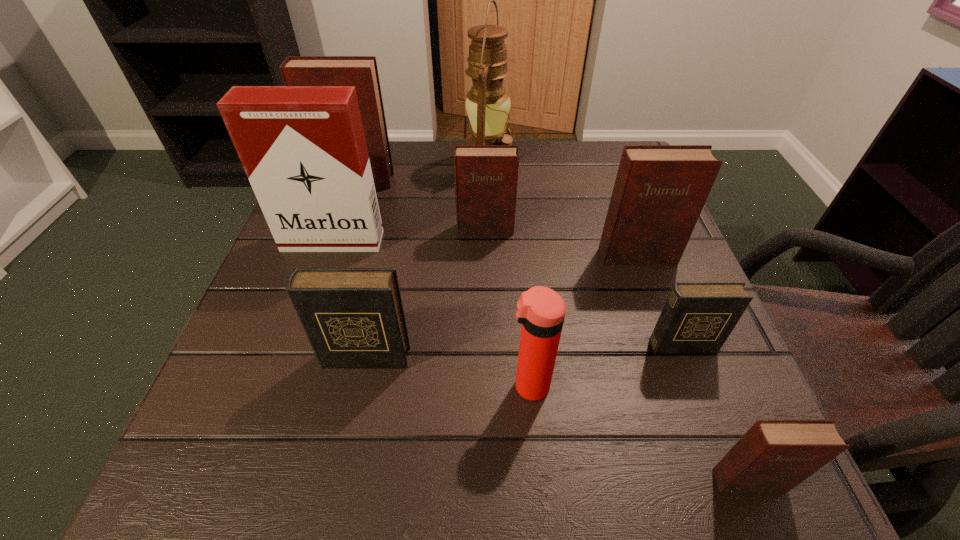
Find the location of `the right dark diary`. the right dark diary is located at coordinates (698, 317).

Image resolution: width=960 pixels, height=540 pixels. Identify the location of the nearest diary. (773, 455).

Locate an element on the screen. Image resolution: width=960 pixels, height=540 pixels. the nearest reddish-brown diary is located at coordinates (773, 455).

The height and width of the screenshot is (540, 960). I want to click on vacant area situated 0.400m on the front of the oil lamp, so click(x=492, y=310).

Where is `vacant space located on the front-facing side of the red cigarette_case`? vacant space located on the front-facing side of the red cigarette_case is located at coordinates (283, 383).

Identify the location of free space located 0.160m on the front cover of the farthest diary. (337, 234).

In order to click on vacant space located 0.360m on the front cover of the third farthest diary in this screenshot , I will do `click(708, 454)`.

Where is `vacant position located 0.060m on the back of the second nearest object`? The height and width of the screenshot is (540, 960). vacant position located 0.060m on the back of the second nearest object is located at coordinates (525, 340).

Where is `free spot located on the front cover of the third nearest reddish-brown diary`? free spot located on the front cover of the third nearest reddish-brown diary is located at coordinates (486, 258).

The height and width of the screenshot is (540, 960). In order to click on vacant position located on the front cover of the left dark diary in this screenshot , I will do `click(352, 417)`.